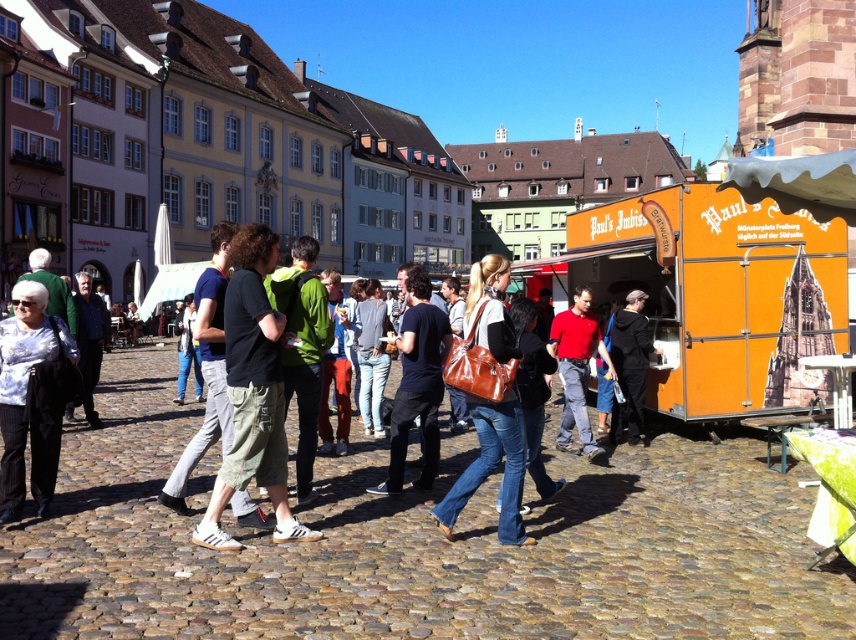
You are a traveler who just arrived in the town square and are looking for your luggage. You see a brown leather bag at center and a black leather jacket at center. Which item is more likely to be your luggage?

The brown leather bag at center is more likely to be your luggage since it is a bag, while the black leather jacket at center is a jacket and not a luggage item.

You are a customer at the food truck and want to buy a Bierwurst. You see two people in black matte shirt at center and black leather jacket at center. Which person is standing to the right of the other?

The black leather jacket at center is to the right of the black matte shirt at center.

From the picture: You are standing in the town square and see the food truck with its bright orange exterior and white roof. There is a point marked at coordinates (253,392). What is located at that point?

The point at (253,392) marks green cargo shorts at center.